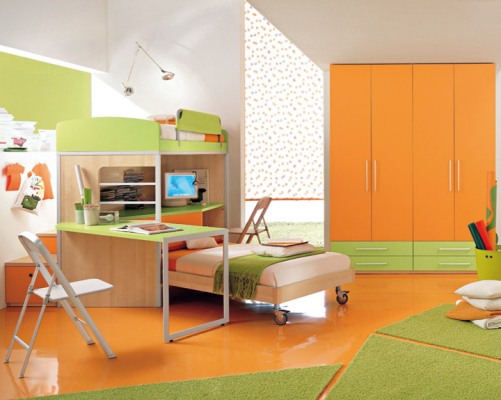
The image size is (501, 400). Find the location of `orange floor`. orange floor is located at coordinates pyautogui.click(x=387, y=297).